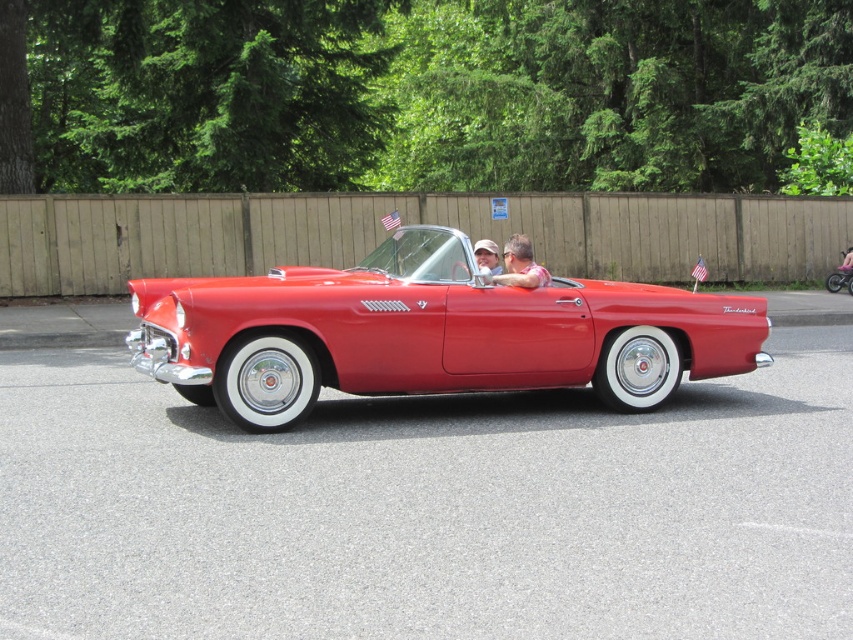
Is shiny red convertible at center taller than matte black sunglasses at center?

Yes, shiny red convertible at center is taller than matte black sunglasses at center.

Who is higher up, shiny red convertible at center or matte black sunglasses at center?

matte black sunglasses at center

Between point (425, 291) and point (535, 285), which one is positioned behind?

The point (535, 285) is more distant.

Where is `shiny red convertible at center`? This screenshot has height=640, width=853. shiny red convertible at center is located at coordinates (428, 333).